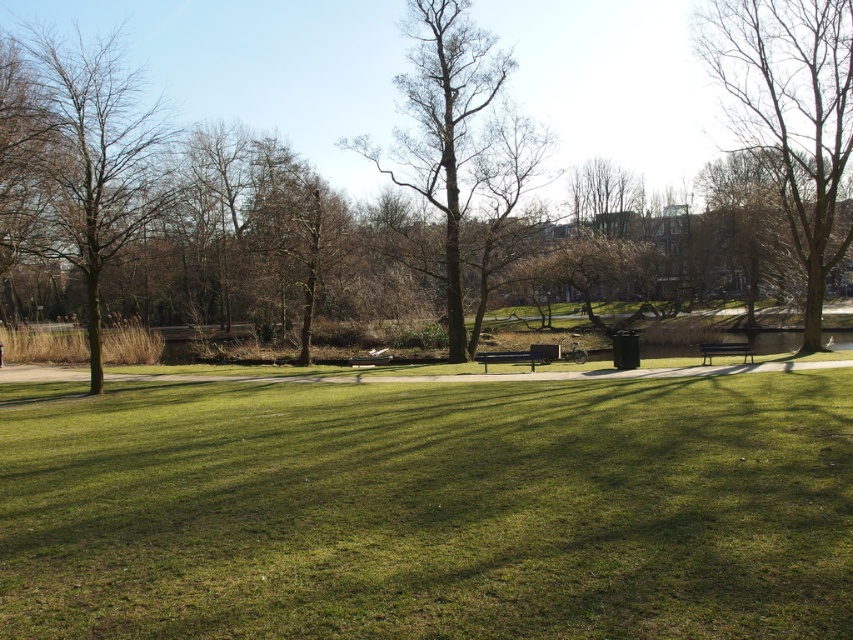
Question: Is brown leafless tree at center below brown textured tree at left?

Choices:
 (A) yes
 (B) no

Answer: (B)

Question: Which object is positioned farthest from the metallic silver bench at center?

Choices:
 (A) wooden bench at right
 (B) bare wood tree at center
 (C) brown leafless tree at upper right
 (D) brown textured tree at left

Answer: (C)

Question: Where is brown leafless tree at center located in relation to brown leafless tree at upper right in the image?

Choices:
 (A) right
 (B) left

Answer: (B)

Question: Which point is farther to the camera?

Choices:
 (A) wooden bench at right
 (B) bare wood tree at center
 (C) metallic silver bench at center

Answer: (B)

Question: Can you confirm if green grassy field at center is smaller than brown leafless tree at center?

Choices:
 (A) yes
 (B) no

Answer: (A)

Question: Among these points, which one is nearest to the camera?

Choices:
 (A) (474, 476)
 (B) (817, 88)

Answer: (A)